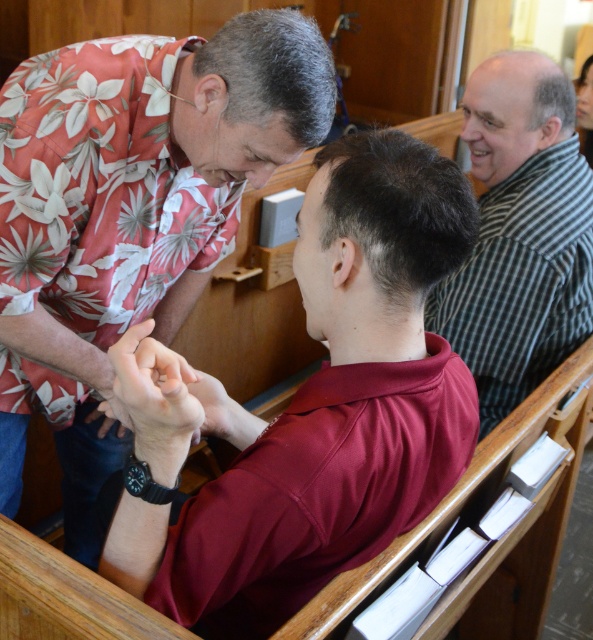
Between point (234, 573) and point (569, 129), which one is positioned in front?

Point (234, 573)

Is point (356, 499) positioned in front of point (578, 144)?

Yes, point (356, 499) is closer to viewer.

Between point (359, 355) and point (508, 353), which one is positioned in front?

Point (359, 355) is in front.

This screenshot has width=593, height=640. What are the coordinates of `maroon jersey at center` in the screenshot? It's located at (310, 406).

Who is positioned more to the right, maroon jersey at center or smooth skin hand at center?

Positioned to the right is maroon jersey at center.

Is maroon jersey at center to the left of smooth skin hand at center from the viewer's perspective?

Incorrect, maroon jersey at center is not on the left side of smooth skin hand at center.

Does point (154, 432) come behind point (151, 364)?

No.

Identify the location of maroon jersey at center. (310, 406).

Does floral print shirt at upper left have a greater width compared to striped cotton shirt at upper right?

Indeed, floral print shirt at upper left has a greater width compared to striped cotton shirt at upper right.

Where is `floral print shirt at upper left`? The image size is (593, 640). floral print shirt at upper left is located at coordinates (129, 212).